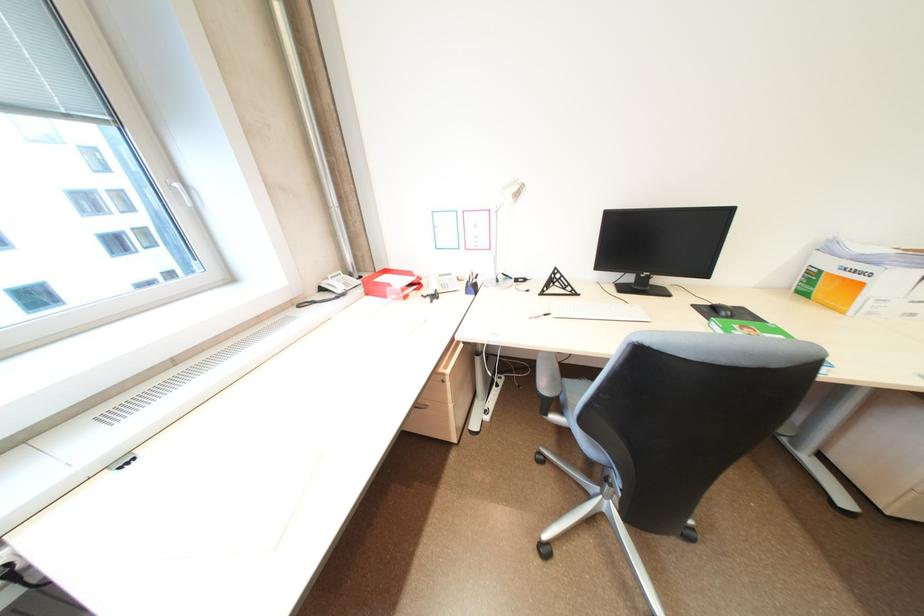
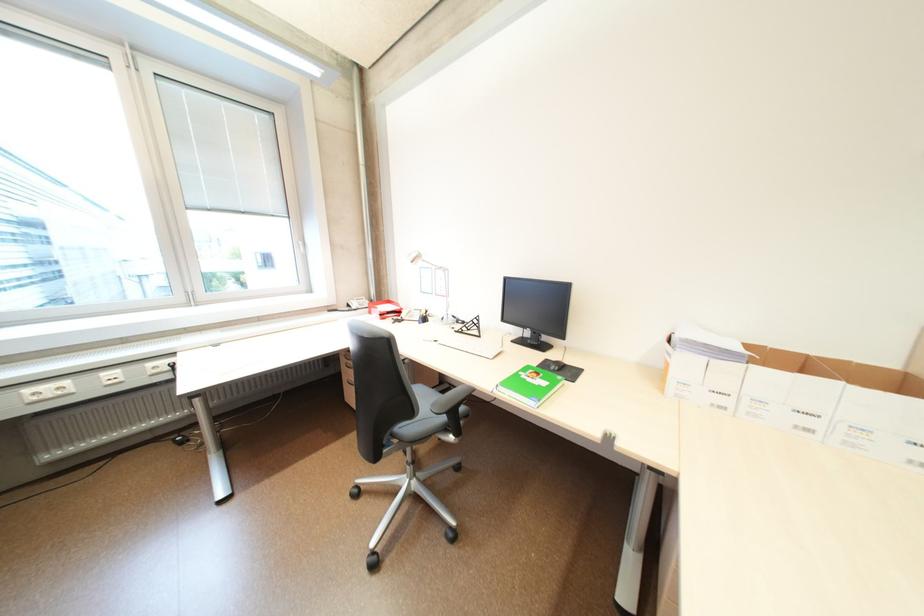
Question: Which direction would the cameraman need to move to produce the second image? Reply with the corresponding letter.

Choices:
 (A) Left
 (B) Right
 (C) Forward
 (D) Backward

Answer: (B)